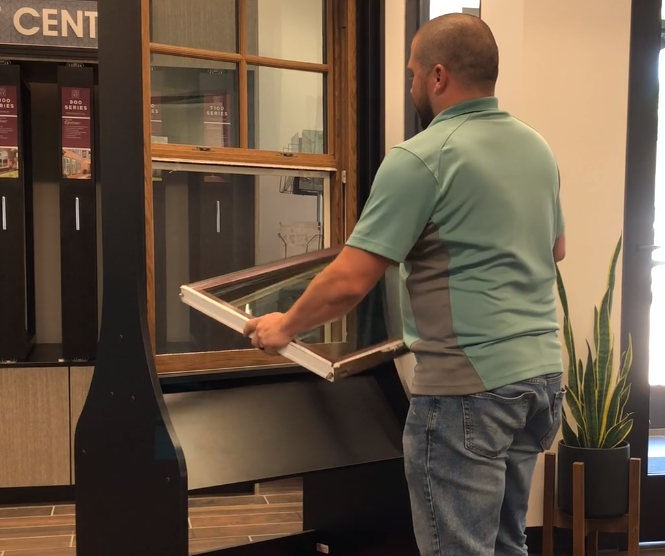
Find the location of a particular element. The image size is (665, 556). wall is located at coordinates 573,66.